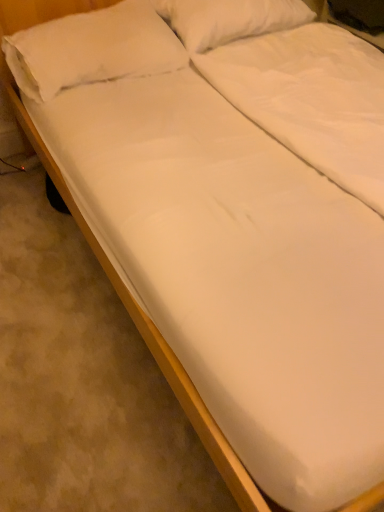
Question: In terms of height, does white soft pillow at upper left, which is the second pillow from right to left, look taller or shorter compared to white soft pillow at upper center, which is the first pillow in right-to-left order?

Choices:
 (A) short
 (B) tall

Answer: (A)

Question: Would you say white soft pillow at upper left, which is the second pillow from right to left, is to the left or to the right of white soft pillow at upper center, which is the first pillow in right-to-left order, in the picture?

Choices:
 (A) right
 (B) left

Answer: (B)

Question: Is point (132, 55) positioned closer to the camera than point (231, 36)?

Choices:
 (A) farther
 (B) closer

Answer: (B)

Question: Looking at their shapes, would you say white soft pillow at upper center, which ranks as the 2th pillow in left-to-right order, is wider or thinner than white soft pillow at upper left, arranged as the 1th pillow when viewed from the left?

Choices:
 (A) wide
 (B) thin

Answer: (B)

Question: From the image's perspective, is white soft pillow at upper center, which is the first pillow in right-to-left order, positioned above or below white soft pillow at upper left, which is the second pillow from right to left?

Choices:
 (A) above
 (B) below

Answer: (A)

Question: Is point (162, 9) positioned closer to the camera than point (132, 28)?

Choices:
 (A) closer
 (B) farther

Answer: (B)

Question: Considering the positions of white soft pillow at upper center, which ranks as the 2th pillow in left-to-right order, and white soft pillow at upper left, arranged as the 1th pillow when viewed from the left, in the image, is white soft pillow at upper center, which ranks as the 2th pillow in left-to-right order, taller or shorter than white soft pillow at upper left, arranged as the 1th pillow when viewed from the left,?

Choices:
 (A) tall
 (B) short

Answer: (A)